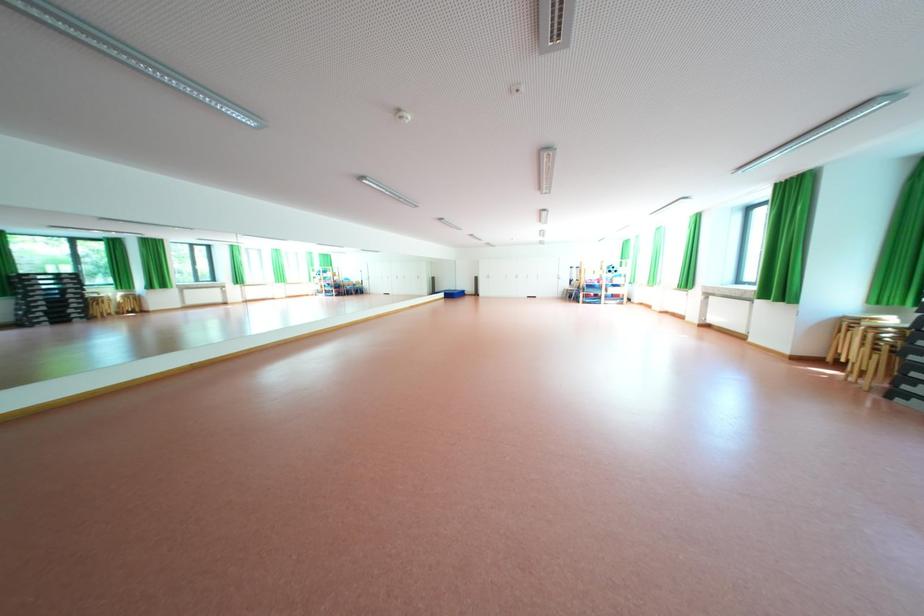
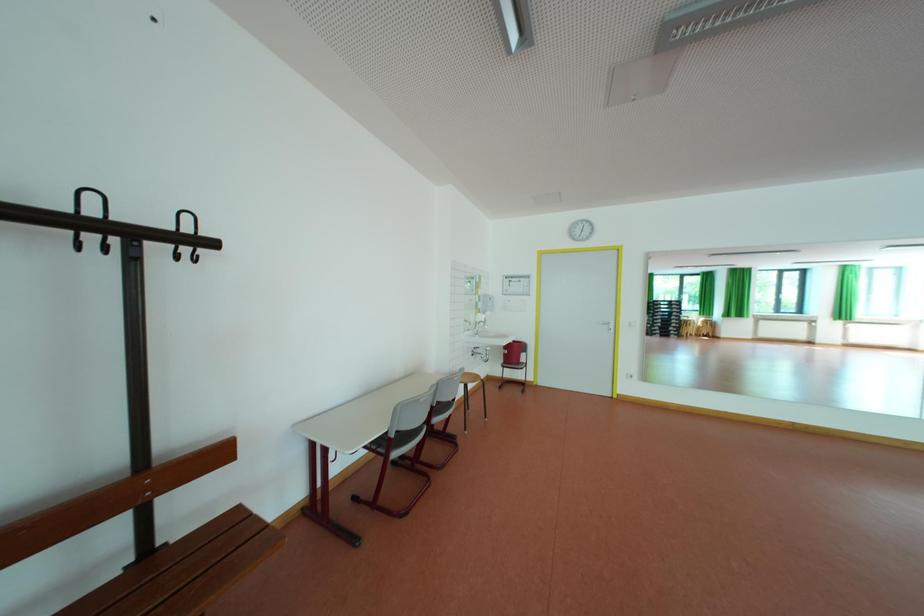
Question: The camera is either moving clockwise (left) or counter-clockwise (right) around the object. The first image is from the beginning of the video and the second image is from the end. Is the camera moving left or right when shooting the video?

Choices:
 (A) Left
 (B) Right

Answer: (B)